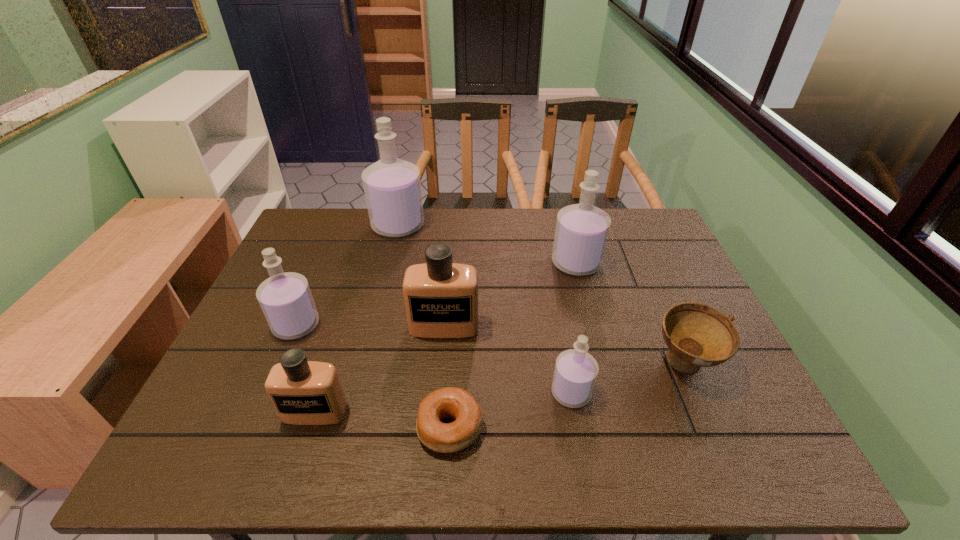
The image size is (960, 540). In order to click on the biggest purple perfume in this screenshot , I will do `click(392, 186)`.

Locate an element on the screen. This screenshot has height=540, width=960. the farthest perfume is located at coordinates (392, 186).

This screenshot has width=960, height=540. What are the coordinates of `the fifth shortest perfume` in the screenshot? It's located at (581, 233).

Where is `the third smallest purple perfume`? This screenshot has height=540, width=960. the third smallest purple perfume is located at coordinates click(x=581, y=233).

The width and height of the screenshot is (960, 540). Identify the location of the second nearest purple perfume. (286, 300).

Locate an element on the screen. This screenshot has height=540, width=960. the second smallest purple perfume is located at coordinates (286, 300).

Where is `the right beige perfume`? The height and width of the screenshot is (540, 960). the right beige perfume is located at coordinates (441, 298).

Where is `the farther beige perfume`? Image resolution: width=960 pixels, height=540 pixels. the farther beige perfume is located at coordinates (441, 298).

Where is `the smallest purple perfume`? The height and width of the screenshot is (540, 960). the smallest purple perfume is located at coordinates (575, 373).

Where is `the nearer beige perfume`? The image size is (960, 540). the nearer beige perfume is located at coordinates (303, 392).